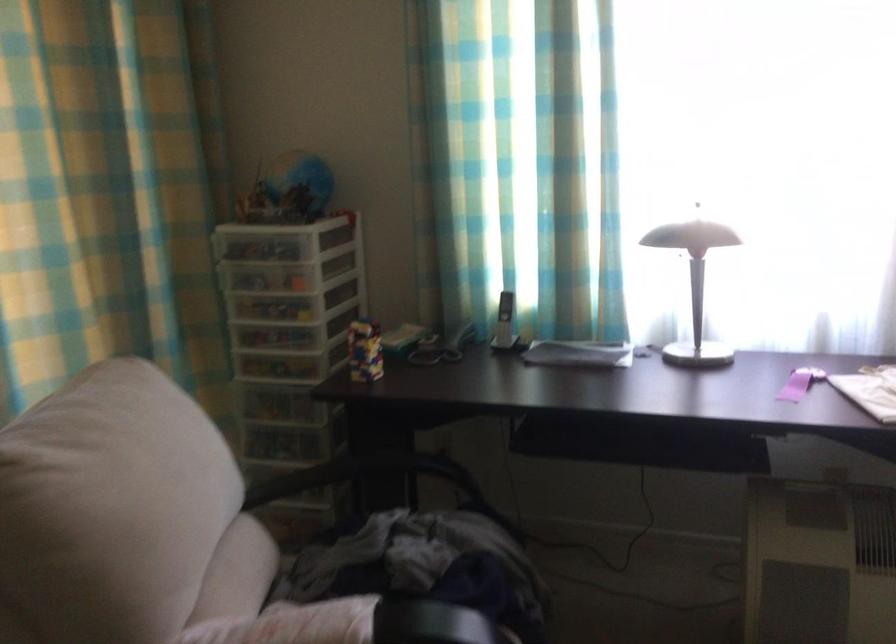
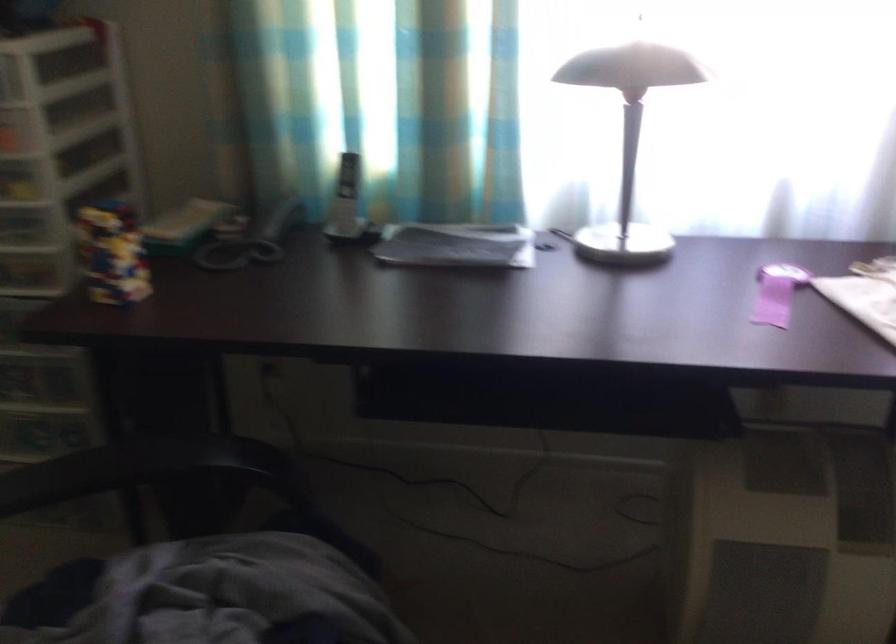
Question: Which direction would the cameraman need to move to produce the second image? Reply with the corresponding letter.

Choices:
 (A) Left
 (B) Right
 (C) Forward
 (D) Backward

Answer: (C)